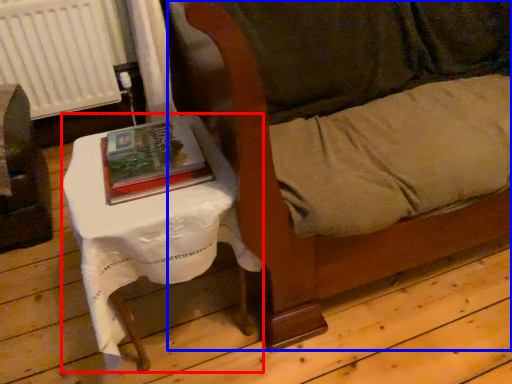
Question: Among these objects, which one is farthest to the camera, table (highlighted by a red box) or couch (highlighted by a blue box)?

Choices:
 (A) table
 (B) couch

Answer: (A)